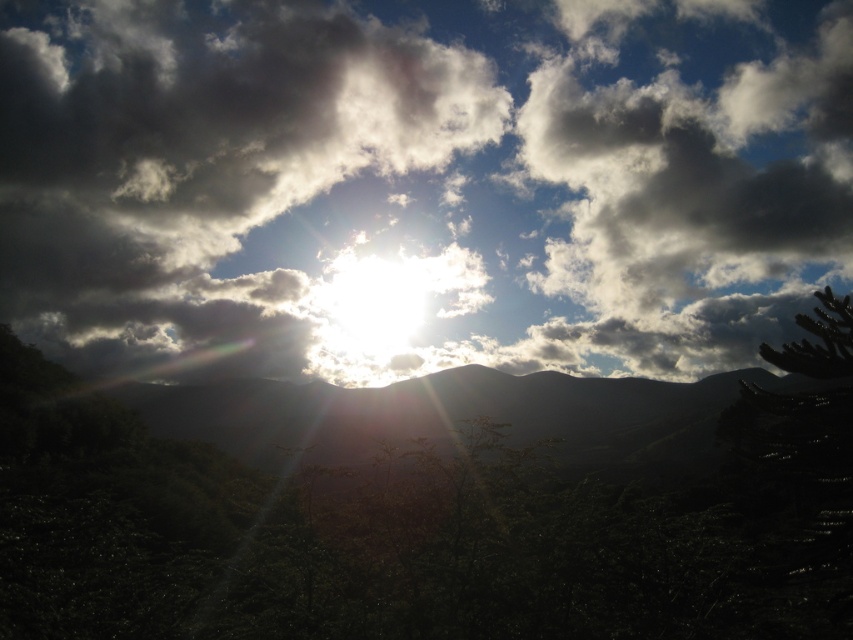
Is white fluffy cloud at upper center to the left of green leafy tree at center from the viewer's perspective?

Incorrect, white fluffy cloud at upper center is not on the left side of green leafy tree at center.

Is white fluffy cloud at upper center above green leafy tree at center?

Yes, white fluffy cloud at upper center is above green leafy tree at center.

The image size is (853, 640). Describe the element at coordinates (421, 182) in the screenshot. I see `white fluffy cloud at upper center` at that location.

Identify the location of white fluffy cloud at upper center. (421, 182).